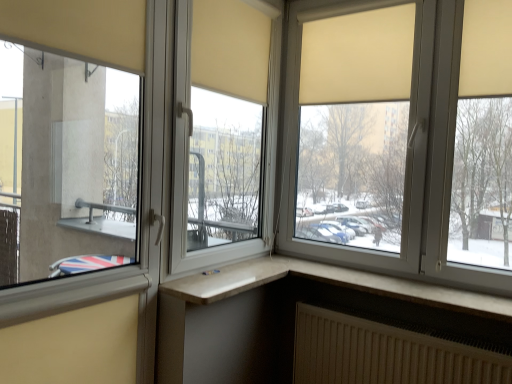
The width and height of the screenshot is (512, 384). What do you see at coordinates (385, 354) in the screenshot?
I see `white textured radiator at lower right` at bounding box center [385, 354].

Looking at this image, measure the distance between white textured radiator at lower right and camera.

white textured radiator at lower right is 1.55 meters from camera.

Measure the distance between matte glass window at left, arranged as the third window when viewed from the right, and camera.

matte glass window at left, arranged as the third window when viewed from the right, is 8.54 feet from camera.

Find the location of `white textured radiator at lower right`. white textured radiator at lower right is located at coordinates (385, 354).

Considering the sizes of matte beige roller blind at upper right, placed as the 2th window when sorted from right to left, and white textured radiator at lower right in the image, is matte beige roller blind at upper right, placed as the 2th window when sorted from right to left, taller or shorter than white textured radiator at lower right?

matte beige roller blind at upper right, placed as the 2th window when sorted from right to left, is taller than white textured radiator at lower right.

Can you confirm if matte beige roller blind at upper right, placed as the 2th window when sorted from right to left, is positioned to the right of white textured radiator at lower right?

Correct, you'll find matte beige roller blind at upper right, placed as the 2th window when sorted from right to left, to the right of white textured radiator at lower right.

Is matte beige roller blind at upper right, which ranks as the 2th window in left-to-right order, placed right next to white textured radiator at lower right?

matte beige roller blind at upper right, which ranks as the 2th window in left-to-right order, is not next to white textured radiator at lower right, and they're not touching.

Is matte beige roller blind at upper right, which ranks as the 2th window in left-to-right order, situated inside white textured radiator at lower right or outside?

matte beige roller blind at upper right, which ranks as the 2th window in left-to-right order, lies outside white textured radiator at lower right.

In the scene shown: Does white plastic window at lower right, the 1th window viewed from the right, have a lesser height compared to matte glass window at left, the first window when ordered from left to right?

Yes.

Identify the location of window that appears below the matte glass window at left, arranged as the third window when viewed from the right (from the image's perspective). The width and height of the screenshot is (512, 384). (329, 282).

Is white plastic window at lower right, the 1th window viewed from the right, to the right of matte glass window at left, arranged as the third window when viewed from the right, from the viewer's perspective?

Correct, you'll find white plastic window at lower right, the 1th window viewed from the right, to the right of matte glass window at left, arranged as the third window when viewed from the right.

Between white plastic window at lower right, the 1th window viewed from the right, and matte glass window at left, the first window when ordered from left to right, which one has larger size?

matte glass window at left, the first window when ordered from left to right.

From a real-world perspective, count 3rd windows upward from the white textured radiator at lower right and point to it. Please provide its 2D coordinates.

[(400, 138)]

In terms of height, does white textured radiator at lower right look taller or shorter compared to matte beige roller blind at upper right, which ranks as the 2th window in left-to-right order?

Clearly, white textured radiator at lower right is shorter compared to matte beige roller blind at upper right, which ranks as the 2th window in left-to-right order.

Is white textured radiator at lower right next to matte beige roller blind at upper right, placed as the 2th window when sorted from right to left?

No, white textured radiator at lower right is not next to matte beige roller blind at upper right, placed as the 2th window when sorted from right to left.

In the scene shown: Considering the relative sizes of white textured radiator at lower right and white plastic window at lower right, the 1th window viewed from the right, in the image provided, is white textured radiator at lower right thinner than white plastic window at lower right, the 1th window viewed from the right,?

Indeed, white textured radiator at lower right has a lesser width compared to white plastic window at lower right, the 1th window viewed from the right.

Is white textured radiator at lower right touching white plastic window at lower right, marked as the third window in a left-to-right arrangement?

No, white textured radiator at lower right is not with white plastic window at lower right, marked as the third window in a left-to-right arrangement.

Can you confirm if white textured radiator at lower right is shorter than white plastic window at lower right, the 1th window viewed from the right?

No, white textured radiator at lower right is not shorter than white plastic window at lower right, the 1th window viewed from the right.

Is matte glass window at left, the first window when ordered from left to right, aimed at white plastic window at lower right, marked as the third window in a left-to-right arrangement?

No, matte glass window at left, the first window when ordered from left to right, does not turn towards white plastic window at lower right, marked as the third window in a left-to-right arrangement.

Is matte glass window at left, the first window when ordered from left to right, next to white plastic window at lower right, marked as the third window in a left-to-right arrangement, and touching it?

They are not placed beside each other.

From a real-world perspective, is matte glass window at left, the first window when ordered from left to right, on white plastic window at lower right, marked as the third window in a left-to-right arrangement?

Yes, from a real-world perspective, matte glass window at left, the first window when ordered from left to right, is above white plastic window at lower right, marked as the third window in a left-to-right arrangement.

How different are the orientations of matte glass window at left, the first window when ordered from left to right, and white plastic window at lower right, marked as the third window in a left-to-right arrangement, in degrees?

There is a 90.7-degree angle between the facing directions of matte glass window at left, the first window when ordered from left to right, and white plastic window at lower right, marked as the third window in a left-to-right arrangement.

From their relative heights in the image, would you say white plastic window at lower right, the 1th window viewed from the right, is taller or shorter than matte beige roller blind at upper right, placed as the 2th window when sorted from right to left?

Clearly, white plastic window at lower right, the 1th window viewed from the right, is shorter compared to matte beige roller blind at upper right, placed as the 2th window when sorted from right to left.

Which object is positioned more to the right, white plastic window at lower right, the 1th window viewed from the right, or matte beige roller blind at upper right, placed as the 2th window when sorted from right to left?

Positioned to the right is white plastic window at lower right, the 1th window viewed from the right.

Is white plastic window at lower right, marked as the third window in a left-to-right arrangement, directly adjacent to matte beige roller blind at upper right, placed as the 2th window when sorted from right to left?

white plastic window at lower right, marked as the third window in a left-to-right arrangement, is not next to matte beige roller blind at upper right, placed as the 2th window when sorted from right to left, and they're not touching.

Is point (464, 301) closer or farther from the camera than point (490, 240)?

Point (464, 301) is positioned closer to the camera compared to point (490, 240).

This screenshot has width=512, height=384. There is a matte beige roller blind at upper right, which ranks as the 2th window in left-to-right order. What are the coordinates of `the 1st window below it (from the image's perspective)` in the screenshot? It's located at (66, 166).

Considering their positions, is matte beige roller blind at upper right, placed as the 2th window when sorted from right to left, located in front of or behind matte glass window at left, the first window when ordered from left to right?

matte beige roller blind at upper right, placed as the 2th window when sorted from right to left, is behind matte glass window at left, the first window when ordered from left to right.

Can you confirm if matte beige roller blind at upper right, placed as the 2th window when sorted from right to left, is shorter than matte glass window at left, the first window when ordered from left to right?

Indeed, matte beige roller blind at upper right, placed as the 2th window when sorted from right to left, has a lesser height compared to matte glass window at left, the first window when ordered from left to right.

Is matte beige roller blind at upper right, placed as the 2th window when sorted from right to left, inside or outside of matte glass window at left, the first window when ordered from left to right?

matte beige roller blind at upper right, placed as the 2th window when sorted from right to left, is located beyond the bounds of matte glass window at left, the first window when ordered from left to right.

The height and width of the screenshot is (384, 512). What are the coordinates of `the 2nd window behind the white textured radiator at lower right, starting your count from the anchor` in the screenshot? It's located at (400, 138).

Locate an element on the screen. the 1st window directly above the white plastic window at lower right, the 1th window viewed from the right (from a real-world perspective) is located at coordinates (66, 166).

Based on their spatial positions, is matte beige roller blind at upper right, which ranks as the 2th window in left-to-right order, or white textured radiator at lower right further from white plastic window at lower right, marked as the third window in a left-to-right arrangement?

matte beige roller blind at upper right, which ranks as the 2th window in left-to-right order.

From the picture: Looking at the image, which one is located closer to matte glass window at left, the first window when ordered from left to right, white textured radiator at lower right or white plastic window at lower right, the 1th window viewed from the right?

The object closer to matte glass window at left, the first window when ordered from left to right, is white plastic window at lower right, the 1th window viewed from the right.

Based on their spatial positions, is matte glass window at left, the first window when ordered from left to right, or matte beige roller blind at upper right, placed as the 2th window when sorted from right to left, further from white plastic window at lower right, marked as the third window in a left-to-right arrangement?

matte glass window at left, the first window when ordered from left to right, is further to white plastic window at lower right, marked as the third window in a left-to-right arrangement.

From the image, which object appears to be farther from matte glass window at left, arranged as the third window when viewed from the right, white plastic window at lower right, marked as the third window in a left-to-right arrangement, or matte beige roller blind at upper right, placed as the 2th window when sorted from right to left?

Among the two, white plastic window at lower right, marked as the third window in a left-to-right arrangement, is located further to matte glass window at left, arranged as the third window when viewed from the right.

Considering their positions, is matte glass window at left, arranged as the third window when viewed from the right, positioned further to matte beige roller blind at upper right, which ranks as the 2th window in left-to-right order, than white textured radiator at lower right?

Among the two, matte glass window at left, arranged as the third window when viewed from the right, is located further to matte beige roller blind at upper right, which ranks as the 2th window in left-to-right order.

Considering their positions, is matte beige roller blind at upper right, which ranks as the 2th window in left-to-right order, positioned further to white plastic window at lower right, marked as the third window in a left-to-right arrangement, than matte glass window at left, the first window when ordered from left to right?

matte glass window at left, the first window when ordered from left to right.

From the image, which object appears to be farther from matte beige roller blind at upper right, which ranks as the 2th window in left-to-right order, white plastic window at lower right, the 1th window viewed from the right, or matte glass window at left, the first window when ordered from left to right?

matte glass window at left, the first window when ordered from left to right, is further to matte beige roller blind at upper right, which ranks as the 2th window in left-to-right order.

Looking at the image, which one is located closer to matte glass window at left, the first window when ordered from left to right, matte beige roller blind at upper right, which ranks as the 2th window in left-to-right order, or white plastic window at lower right, marked as the third window in a left-to-right arrangement?

The object closer to matte glass window at left, the first window when ordered from left to right, is matte beige roller blind at upper right, which ranks as the 2th window in left-to-right order.

Locate an element on the screen. radiator situated between matte glass window at left, the first window when ordered from left to right, and white plastic window at lower right, marked as the third window in a left-to-right arrangement, from left to right is located at coordinates (385, 354).

Find the location of a particular element. The image size is (512, 384). window between matte glass window at left, arranged as the third window when viewed from the right, and white plastic window at lower right, the 1th window viewed from the right, from left to right is located at coordinates (400, 138).

Identify the location of radiator between matte glass window at left, arranged as the third window when viewed from the right, and matte beige roller blind at upper right, placed as the 2th window when sorted from right to left, from left to right. (385, 354).